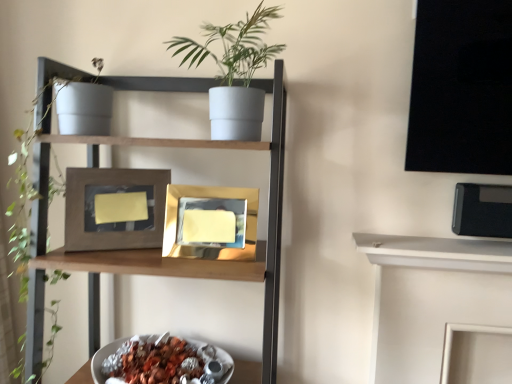
Question: From a real-world perspective, is matte gray pot at upper center under matte gray pot at upper left?

Choices:
 (A) no
 (B) yes

Answer: (A)

Question: Can you confirm if matte gray pot at upper center is positioned to the right of matte gray pot at upper left?

Choices:
 (A) no
 (B) yes

Answer: (B)

Question: Is matte gray pot at upper center facing away from matte gray pot at upper left?

Choices:
 (A) no
 (B) yes

Answer: (A)

Question: Can you confirm if matte gray pot at upper center is taller than matte gray pot at upper left?

Choices:
 (A) no
 (B) yes

Answer: (A)

Question: From a real-world perspective, is matte gray pot at upper center on top of matte gray pot at upper left?

Choices:
 (A) no
 (B) yes

Answer: (B)

Question: Is the depth of matte gray pot at upper center less than that of matte gray pot at upper left?

Choices:
 (A) yes
 (B) no

Answer: (A)

Question: Does matte gray pot at upper left touch shiny metallic bowl at lower center?

Choices:
 (A) no
 (B) yes

Answer: (A)

Question: Is matte gray pot at upper left at the left side of shiny metallic bowl at lower center?

Choices:
 (A) yes
 (B) no

Answer: (A)

Question: Can you confirm if matte gray pot at upper left is shorter than shiny metallic bowl at lower center?

Choices:
 (A) no
 (B) yes

Answer: (A)

Question: Is matte gray pot at upper left closer to camera compared to shiny metallic bowl at lower center?

Choices:
 (A) yes
 (B) no

Answer: (A)

Question: Would you consider matte gray pot at upper left to be distant from shiny metallic bowl at lower center?

Choices:
 (A) yes
 (B) no

Answer: (B)

Question: Is matte gray pot at upper left not inside shiny metallic bowl at lower center?

Choices:
 (A) no
 (B) yes

Answer: (B)

Question: Is matte brown picture frame at center, acting as the second picture frame starting from the right, further to the viewer compared to gold reflective photo frame at center, the first picture frame viewed from the right?

Choices:
 (A) no
 (B) yes

Answer: (B)